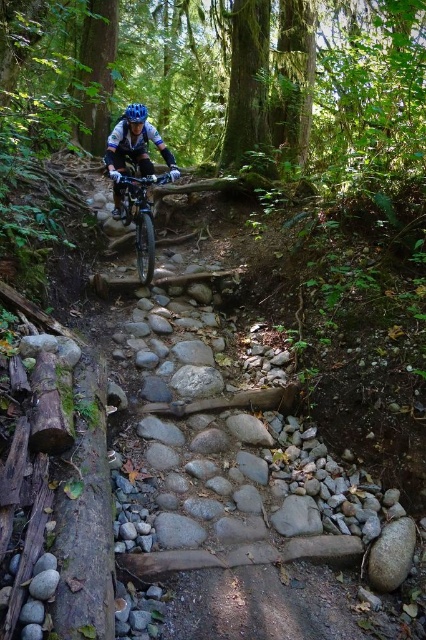
Who is positioned more to the left, shiny metallic bicycle at center or matte blue helmet at center?

Positioned to the left is matte blue helmet at center.

Can you confirm if shiny metallic bicycle at center is bigger than matte blue helmet at center?

No.

Which is in front, point (140, 250) or point (126, 113)?

Point (126, 113) is more forward.

Identify the location of shiny metallic bicycle at center. coord(141,216).

Does point (112, 172) come behind point (135, 221)?

No, (112, 172) is closer to viewer.

Between point (134, 109) and point (121, 186), which one is positioned behind?

Point (121, 186)

Does point (146, 132) come behind point (140, 252)?

That is False.

The image size is (426, 640). I want to click on matte black helmet at center, so click(x=134, y=148).

The height and width of the screenshot is (640, 426). I want to click on matte black helmet at center, so click(x=134, y=148).